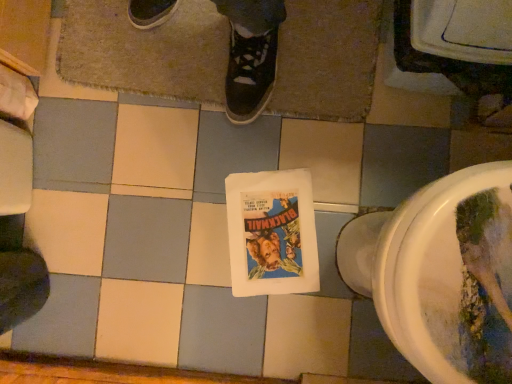
The width and height of the screenshot is (512, 384). What are the coordinates of `vacant space that's between matte paper comic book at center and brown textured bath mat at upper center` in the screenshot? It's located at (216, 172).